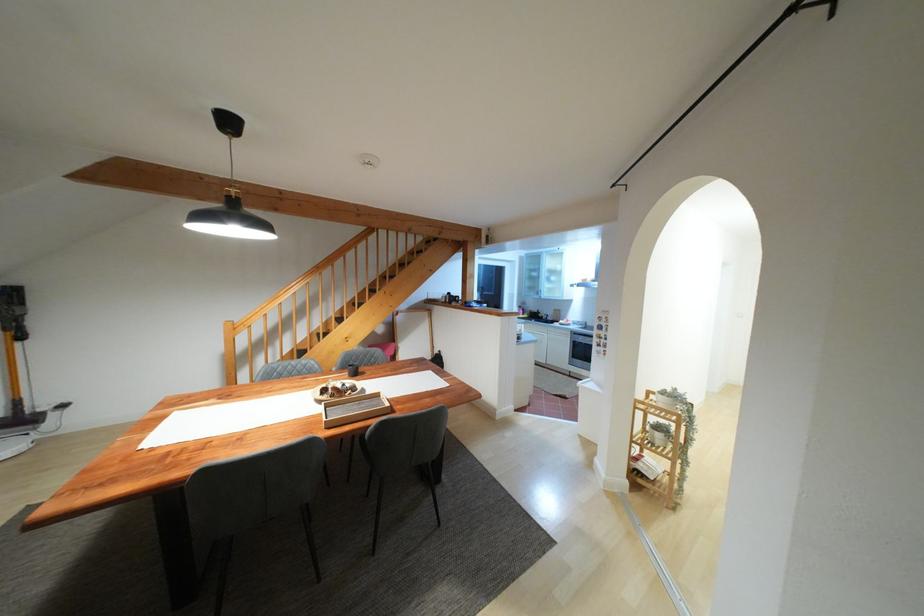
The height and width of the screenshot is (616, 924). I want to click on wooden tray, so click(354, 408).